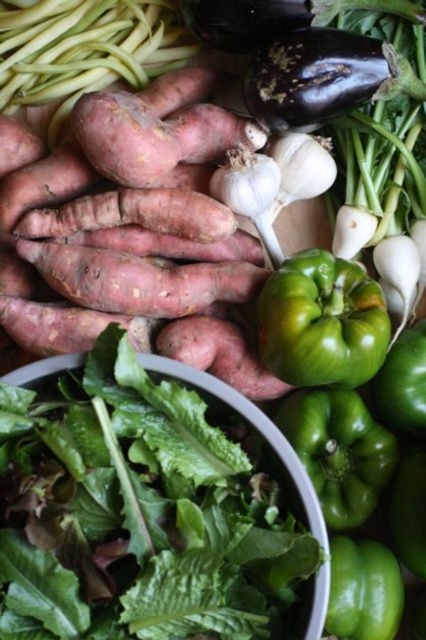
Question: Is rustic brown sweet potato at center closer to the viewer compared to green matte bell pepper at center?

Choices:
 (A) no
 (B) yes

Answer: (A)

Question: Among these points, which one is nearest to the camera?

Choices:
 (A) (86, 184)
 (B) (319, 371)

Answer: (B)

Question: Is rustic brown sweet potato at center positioned behind green matte bell pepper at center?

Choices:
 (A) no
 (B) yes

Answer: (B)

Question: Which of the following is the closest to the observer?

Choices:
 (A) (365, 358)
 (B) (236, 294)

Answer: (A)

Question: Is rustic brown sweet potato at center positioned in front of green matte bell pepper at center?

Choices:
 (A) yes
 (B) no

Answer: (B)